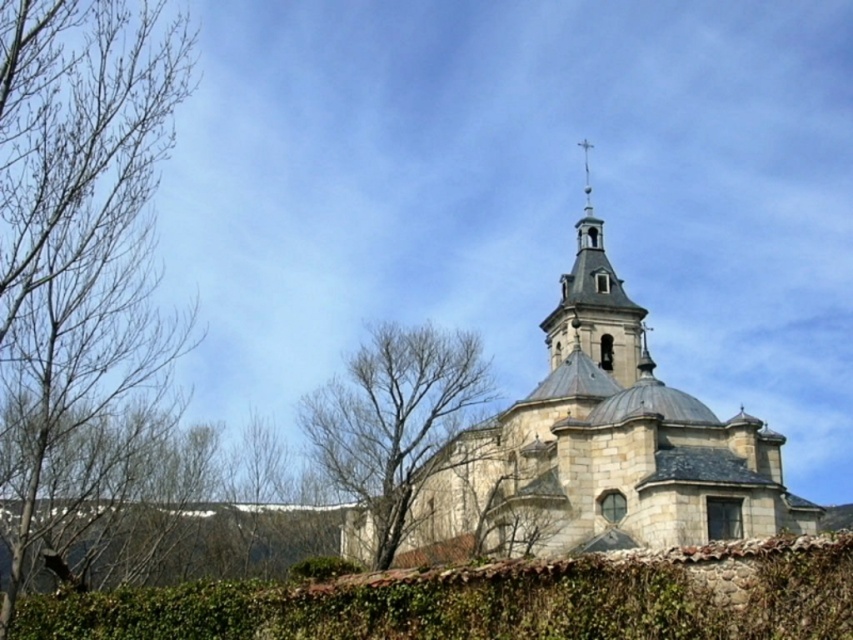
Question: Which point is farther from the camera taking this photo?

Choices:
 (A) (587, 252)
 (B) (68, 124)

Answer: (A)

Question: Is stone church at center bigger than stone bell tower at upper center?

Choices:
 (A) no
 (B) yes

Answer: (B)

Question: Which object is farther from the camera taking this photo?

Choices:
 (A) green ivy hedge at lower center
 (B) bare branches at left
 (C) bare wood tree at center
 (D) stone church at center

Answer: (C)

Question: Considering the relative positions of bare wood tree at center and stone bell tower at upper center in the image provided, where is bare wood tree at center located with respect to stone bell tower at upper center?

Choices:
 (A) left
 (B) right

Answer: (A)

Question: Which point is farther from the camera taking this photo?

Choices:
 (A) (54, 412)
 (B) (645, 528)

Answer: (B)

Question: Does green ivy hedge at lower center appear under bare wood tree at center?

Choices:
 (A) yes
 (B) no

Answer: (A)